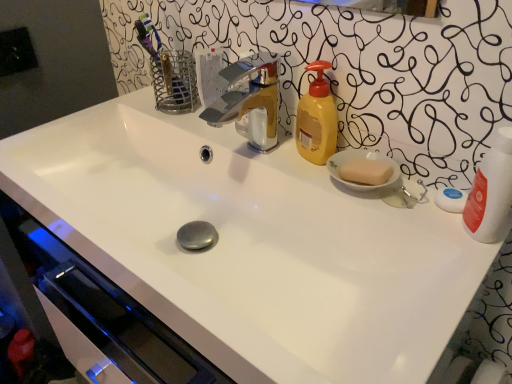
What do you see at coordinates (317, 119) in the screenshot? I see `yellow matte soap dispenser at upper right` at bounding box center [317, 119].

Describe the element at coordinates (249, 100) in the screenshot. I see `polished chrome faucet at center` at that location.

This screenshot has height=384, width=512. Describe the element at coordinates (490, 191) in the screenshot. I see `white glossy bottle at right` at that location.

The width and height of the screenshot is (512, 384). Identify the location of yellow matte soap dispenser at upper right. (317, 119).

Considering the sizes of polished chrome faucet at center and yellow matte soap dispenser at upper right in the image, is polished chrome faucet at center wider or thinner than yellow matte soap dispenser at upper right?

Clearly, polished chrome faucet at center has more width compared to yellow matte soap dispenser at upper right.

Can you confirm if polished chrome faucet at center is bigger than yellow matte soap dispenser at upper right?

Yes, polished chrome faucet at center is bigger than yellow matte soap dispenser at upper right.

Which is closer, (x=264, y=92) or (x=298, y=148)?

The point (x=298, y=148) is in front.

Does polished chrome faucet at center turn towards yellow matte soap dispenser at upper right?

No, polished chrome faucet at center is not aimed at yellow matte soap dispenser at upper right.

Would you say white glossy bottle at right is outside yellow matte soap dispenser at upper right?

Yes, white glossy bottle at right is not within yellow matte soap dispenser at upper right.

Is white glossy bottle at right taller or shorter than yellow matte soap dispenser at upper right?

white glossy bottle at right is taller than yellow matte soap dispenser at upper right.

Considering the sizes of objects polished chrome faucet at center and white glossy bottle at right in the image provided, who is taller, polished chrome faucet at center or white glossy bottle at right?

With more height is white glossy bottle at right.

Consider the image. Which object is positioned more to the left, polished chrome faucet at center or white glossy bottle at right?

From the viewer's perspective, polished chrome faucet at center appears more on the left side.

Considering the relative sizes of polished chrome faucet at center and white glossy bottle at right in the image provided, is polished chrome faucet at center wider than white glossy bottle at right?

Yes, polished chrome faucet at center is wider than white glossy bottle at right.

Is polished chrome faucet at center aimed at white glossy bottle at right?

No, polished chrome faucet at center is not turned towards white glossy bottle at right.

From the picture: How different are the orientations of yellow matte soap dispenser at upper right and white glossy bottle at right in degrees?

There is a 40.5-degree angle between the facing directions of yellow matte soap dispenser at upper right and white glossy bottle at right.

Which point is more forward, (x=325, y=117) or (x=502, y=174)?

The point (x=502, y=174) is more forward.

From the image's perspective, relative to white glossy bottle at right, is yellow matte soap dispenser at upper right above or below?

Clearly, from the image's perspective, yellow matte soap dispenser at upper right is above white glossy bottle at right.

This screenshot has width=512, height=384. In order to click on cleaning product lying in front of the yellow matte soap dispenser at upper right in this screenshot , I will do `click(490, 191)`.

From a real-world perspective, is white glossy bottle at right physically located above or below polished chrome faucet at center?

white glossy bottle at right is above polished chrome faucet at center.

The width and height of the screenshot is (512, 384). I want to click on tap behind the white glossy bottle at right, so click(249, 100).

Is point (469, 207) less distant than point (255, 116)?

Yes, point (469, 207) is closer to viewer.

How many degrees apart are the facing directions of yellow matte soap dispenser at upper right and polished chrome faucet at center?

There is a 8.78-degree angle between the facing directions of yellow matte soap dispenser at upper right and polished chrome faucet at center.

You are a GUI agent. You are given a task and a screenshot of the screen. Output one action in this format:
    pyautogui.click(x=<x>, y=<y>)
    Task: Click on the tap lying in front of the yellow matte soap dispenser at upper right
    
    Given the screenshot: What is the action you would take?
    pyautogui.click(x=249, y=100)

Is point (314, 147) less distant than point (256, 90)?

That is True.

Where is `soap dispenser on the right side of polished chrome faucet at center`? This screenshot has width=512, height=384. soap dispenser on the right side of polished chrome faucet at center is located at coordinates (317, 119).

The height and width of the screenshot is (384, 512). What are the coordinates of `cleaning product in front of the yellow matte soap dispenser at upper right` in the screenshot? It's located at (490, 191).

When comparing their distances from polished chrome faucet at center, does yellow matte soap dispenser at upper right or white glossy bottle at right seem further?

white glossy bottle at right lies further to polished chrome faucet at center than the other object.

From the image, which object appears to be nearer to yellow matte soap dispenser at upper right, polished chrome faucet at center or white glossy bottle at right?

The object closer to yellow matte soap dispenser at upper right is polished chrome faucet at center.

Considering their positions, is white glossy bottle at right positioned further to yellow matte soap dispenser at upper right than polished chrome faucet at center?

Among the two, white glossy bottle at right is located further to yellow matte soap dispenser at upper right.

Considering their positions, is polished chrome faucet at center positioned closer to white glossy bottle at right than yellow matte soap dispenser at upper right?

yellow matte soap dispenser at upper right is closer to white glossy bottle at right.

Looking at the image, which one is located further to polished chrome faucet at center, white glossy bottle at right or yellow matte soap dispenser at upper right?

white glossy bottle at right lies further to polished chrome faucet at center than the other object.

Which object lies further to the anchor point white glossy bottle at right, yellow matte soap dispenser at upper right or polished chrome faucet at center?

polished chrome faucet at center is further to white glossy bottle at right.

Find the location of `soap dispenser located between polished chrome faucet at center and white glossy bottle at right in the left-right direction`. soap dispenser located between polished chrome faucet at center and white glossy bottle at right in the left-right direction is located at coordinates (x=317, y=119).